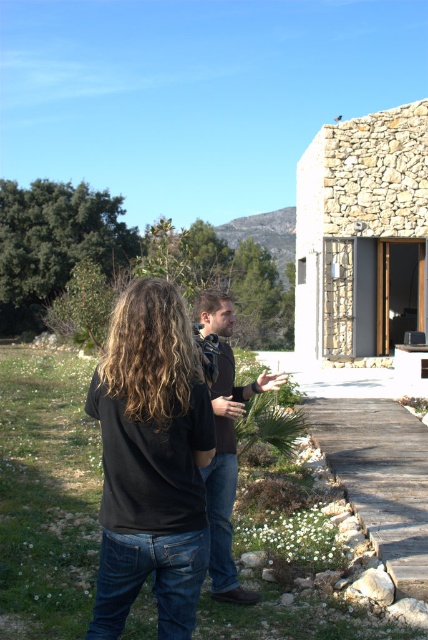
In the scene shown: You are standing in the scene described. You want to place a small potted plant exactly where the wooden at center is located. Is this possible?

Yes, you can place the potted plant exactly at the wooden at center since its 2D coordinates are precisely defined at point (380, 477).

You are a photographer trying to capture a candid shot of the two people in the scene. You notice the black matte shirt at center and the brown leather jacket at center. Which clothing item is positioned higher on the person wearing them?

The black matte shirt at center is above the brown leather jacket at center, so the black matte shirt at center is positioned higher on the person wearing them.